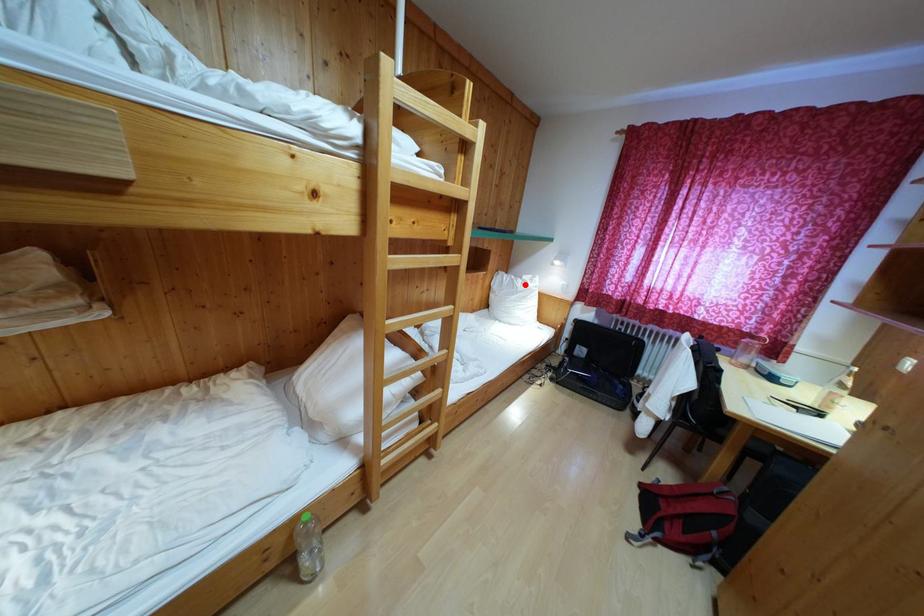
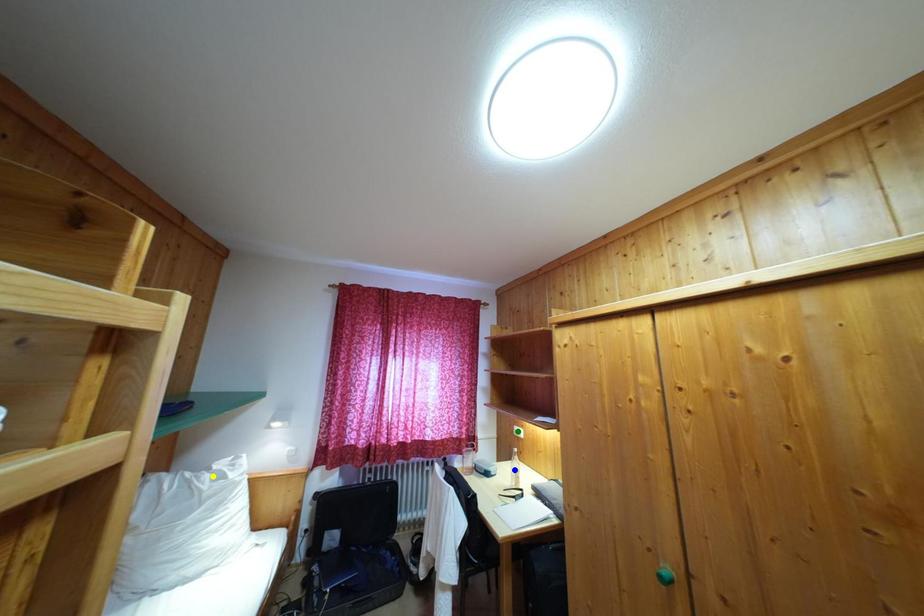
Question: I am providing you with two images of the same scene from different viewpoints. A red point is marked on the first image. You are given multiple points on the second image. Can you choose the point in image 2 that corresponds to the point in image 1?

Choices:
 (A) yellow point
 (B) green point
 (C) blue point

Answer: (A)